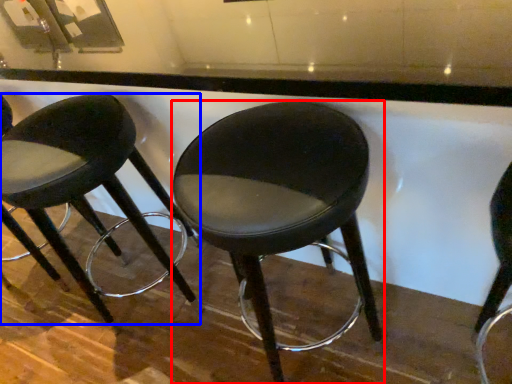
Question: Which object appears farthest to the camera in this image, stool (highlighted by a red box) or stool (highlighted by a blue box)?

Choices:
 (A) stool
 (B) stool

Answer: (B)